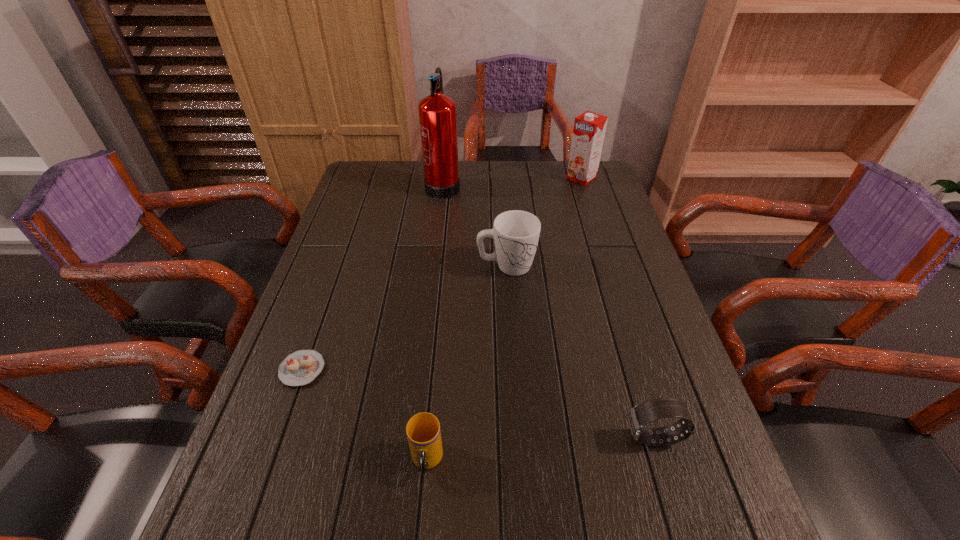
I want to click on watch at the right edge, so pos(640,415).

Where is `object at the far right corner`? object at the far right corner is located at coordinates (589, 129).

Locate an element on the screen. The height and width of the screenshot is (540, 960). vacant space at the far edge of the desktop is located at coordinates (556, 184).

You are a GUI agent. You are given a task and a screenshot of the screen. Output one action in this format:
    pyautogui.click(x=<x>, y=<y>)
    Task: Click on the free space at the near edge of the desktop
    This screenshot has width=960, height=540.
    Given the screenshot: What is the action you would take?
    pyautogui.click(x=584, y=537)

The height and width of the screenshot is (540, 960). In order to click on vacant region at the left edge in this screenshot , I will do click(x=320, y=331).

Where is `free space at the far left corner`? free space at the far left corner is located at coordinates (368, 186).

Where is `vacant space at the far right corner of the desktop`? vacant space at the far right corner of the desktop is located at coordinates (605, 178).

At what (x,y) coordinates should I click in order to perform the action: click on vacant region between the shortest object and the fifth shortest object. Please return your answer as a coordinate pair (x, y). This screenshot has width=960, height=540. Looking at the image, I should click on (442, 273).

Locate an element on the screen. unoccupied area between the cup and the third tallest object is located at coordinates (467, 363).

This screenshot has width=960, height=540. Identify the location of empty space that is in between the shortest object and the carton. (442, 273).